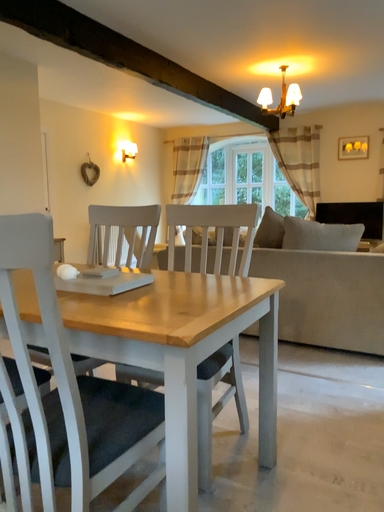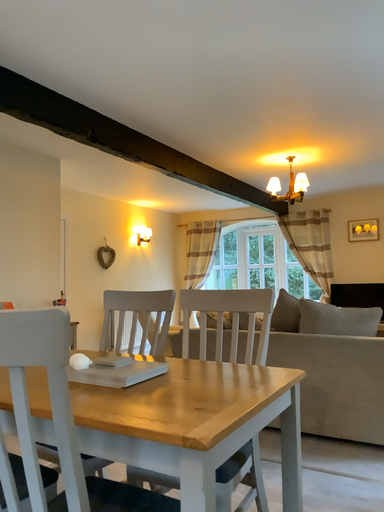
Question: How did the camera likely rotate when shooting the video?

Choices:
 (A) rotated upward
 (B) rotated downward

Answer: (A)